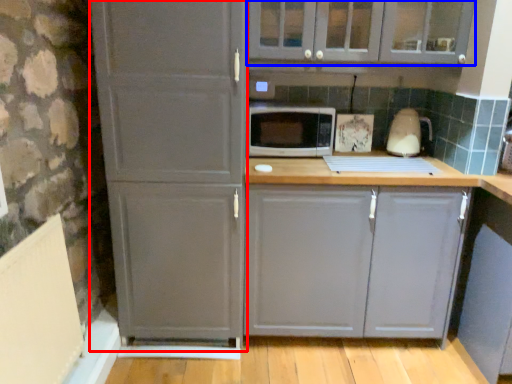
Question: Among these objects, which one is farthest to the camera, screen door (highlighted by a red box) or cabinetry (highlighted by a blue box)?

Choices:
 (A) screen door
 (B) cabinetry

Answer: (B)